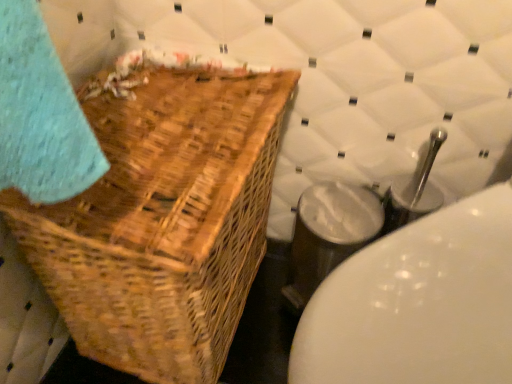
The width and height of the screenshot is (512, 384). I want to click on natural woven picnic basket at left, so click(x=163, y=220).

In order to face natural woven picnic basket at left, should I rotate leftwards or rightwards?

To face it directly, rotate left by 10.030 degrees.

What do you see at coordinates (163, 220) in the screenshot?
I see `natural woven picnic basket at left` at bounding box center [163, 220].

Find the location of a particular element. natural woven picnic basket at left is located at coordinates point(163,220).